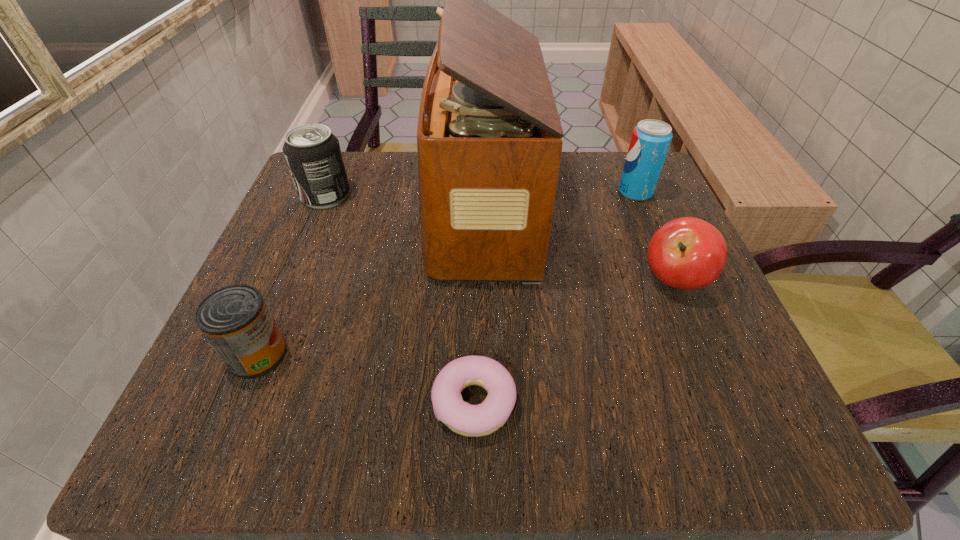
Where is `radio receiver`? The image size is (960, 540). radio receiver is located at coordinates (489, 144).

Where is `the right soda can`? The width and height of the screenshot is (960, 540). the right soda can is located at coordinates (650, 141).

The image size is (960, 540). I want to click on the left soda can, so click(313, 155).

You are a GUI agent. You are given a task and a screenshot of the screen. Output one action in this format:
    pyautogui.click(x=<x>, y=<y>)
    Task: Click on the apple
    Image resolution: width=960 pixels, height=540 pixels.
    Given the screenshot: What is the action you would take?
    [687, 253]

What are the coordinates of `can` in the screenshot? It's located at (235, 319).

The height and width of the screenshot is (540, 960). Identify the location of doughnut. 465,419.

You are a GUI agent. You are given a task and a screenshot of the screen. Output one action in this format:
    pyautogui.click(x=<x>, y=<y>)
    Task: Click on the blank area located 0.060m on the front panel of the tallest object
    
    Given the screenshot: What is the action you would take?
    pyautogui.click(x=396, y=212)

The image size is (960, 540). Find the location of `vacant space located on the front panel of the tallest object`. vacant space located on the front panel of the tallest object is located at coordinates (315, 212).

Where is `vacant space located 0.280m on the front panel of the tallest object`? The image size is (960, 540). vacant space located 0.280m on the front panel of the tallest object is located at coordinates (285, 212).

Where is `free space located on the back of the right soda can`? The height and width of the screenshot is (540, 960). free space located on the back of the right soda can is located at coordinates (626, 170).